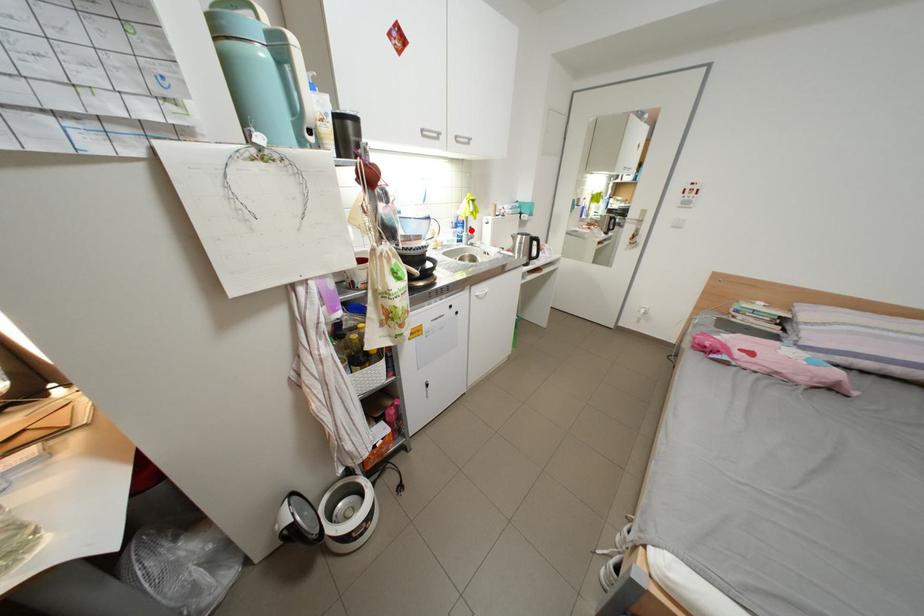
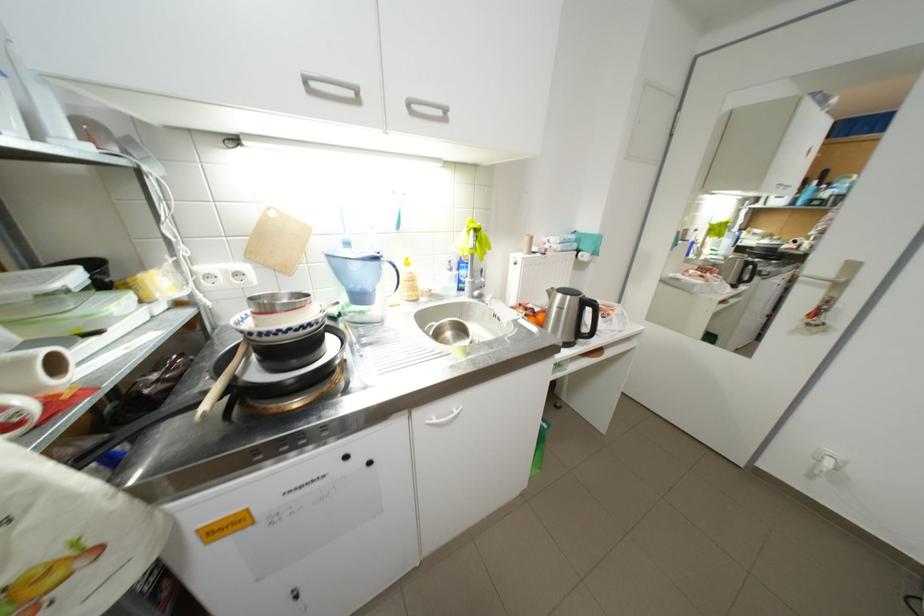
Question: I am providing you with two images of the same scene from different viewpoints. A red point is marked on the first image. At the location where the point appears in image 1, is it still visible in image 2?

Choices:
 (A) Yes
 (B) No

Answer: (A)